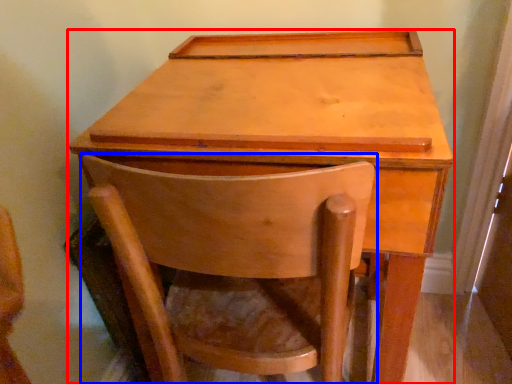
Question: Which object is further to the camera taking this photo, table (highlighted by a red box) or chair (highlighted by a blue box)?

Choices:
 (A) table
 (B) chair

Answer: (A)